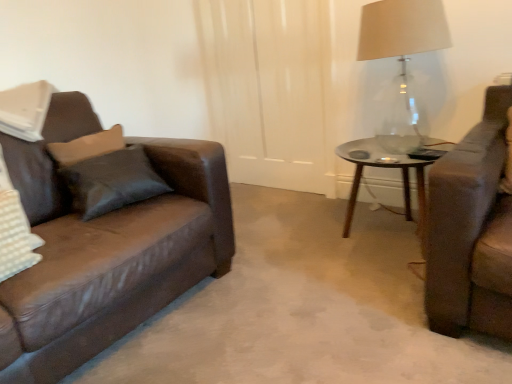
The width and height of the screenshot is (512, 384). What do you see at coordinates (383, 167) in the screenshot?
I see `transparent glass table at center` at bounding box center [383, 167].

The height and width of the screenshot is (384, 512). Identify the location of transparent glass table at center. (383, 167).

This screenshot has width=512, height=384. Find the location of `clear glass table lamp at upper right`. clear glass table lamp at upper right is located at coordinates (402, 58).

What do you see at coordinates (402, 58) in the screenshot? The width and height of the screenshot is (512, 384). I see `clear glass table lamp at upper right` at bounding box center [402, 58].

Where is `transparent glass table at center`? This screenshot has width=512, height=384. transparent glass table at center is located at coordinates (383, 167).

Between transparent glass table at center and clear glass table lamp at upper right, which one appears on the left side from the viewer's perspective?

From the viewer's perspective, clear glass table lamp at upper right appears more on the left side.

Which object is closer to the camera, transparent glass table at center or clear glass table lamp at upper right?

clear glass table lamp at upper right is more forward.

Is point (348, 231) closer or farther from the camera than point (366, 51)?

Point (348, 231).

From the image's perspective, is transparent glass table at center above or below clear glass table lamp at upper right?

transparent glass table at center is situated lower than clear glass table lamp at upper right in the image.

From a real-world perspective, which is physically below, transparent glass table at center or clear glass table lamp at upper right?

transparent glass table at center, from a real-world perspective.

Considering the relative sizes of transparent glass table at center and clear glass table lamp at upper right in the image provided, is transparent glass table at center wider than clear glass table lamp at upper right?

Indeed, transparent glass table at center has a greater width compared to clear glass table lamp at upper right.

Which of these two, transparent glass table at center or clear glass table lamp at upper right, stands shorter?

transparent glass table at center.

Between transparent glass table at center and clear glass table lamp at upper right, which one has larger size?

With larger size is clear glass table lamp at upper right.

Would you say transparent glass table at center is inside or outside clear glass table lamp at upper right?

transparent glass table at center is spatially situated outside clear glass table lamp at upper right.

Is transparent glass table at center positioned far away from clear glass table lamp at upper right?

No, transparent glass table at center is in close proximity to clear glass table lamp at upper right.

Based on the photo, is transparent glass table at center turned away from clear glass table lamp at upper right?

No, transparent glass table at center's orientation is not away from clear glass table lamp at upper right.

Where is `table lamp located on the left of transparent glass table at center`? table lamp located on the left of transparent glass table at center is located at coordinates (402, 58).

Would you say clear glass table lamp at upper right is to the left or to the right of transparent glass table at center in the picture?

In the image, clear glass table lamp at upper right appears on the left side of transparent glass table at center.

Considering the relative positions of clear glass table lamp at upper right and transparent glass table at center in the image provided, is clear glass table lamp at upper right behind transparent glass table at center?

No, the depth of clear glass table lamp at upper right is less than that of transparent glass table at center.

Which point is more forward, [413,100] or [406,155]?

The point [406,155] is closer to the camera.

From the image's perspective, is clear glass table lamp at upper right over transparent glass table at center?

Yes.

From a real-world perspective, is clear glass table lamp at upper right physically below transparent glass table at center?

No, from a real-world perspective, clear glass table lamp at upper right is not beneath transparent glass table at center.

Does clear glass table lamp at upper right have a greater width compared to transparent glass table at center?

No.

Does clear glass table lamp at upper right have a greater height compared to transparent glass table at center?

Indeed, clear glass table lamp at upper right has a greater height compared to transparent glass table at center.

Considering the relative sizes of clear glass table lamp at upper right and transparent glass table at center in the image provided, is clear glass table lamp at upper right smaller than transparent glass table at center?

Actually, clear glass table lamp at upper right might be larger than transparent glass table at center.

Is clear glass table lamp at upper right completely or partially outside of transparent glass table at center?

clear glass table lamp at upper right lies outside transparent glass table at center's area.

Looking at this image, does clear glass table lamp at upper right touch transparent glass table at center?

They are not placed beside each other.

Is transparent glass table at center at the back of clear glass table lamp at upper right?

No, clear glass table lamp at upper right is not facing the opposite direction of transparent glass table at center.

How many degrees apart are the facing directions of clear glass table lamp at upper right and transparent glass table at center?

0.000597 degrees separate the facing orientations of clear glass table lamp at upper right and transparent glass table at center.

Locate an element on the screen. Image resolution: width=512 pixels, height=384 pixels. table lamp located on the left of transparent glass table at center is located at coordinates (402, 58).

Where is `table lamp located above the transparent glass table at center (from a real-world perspective)`? The height and width of the screenshot is (384, 512). table lamp located above the transparent glass table at center (from a real-world perspective) is located at coordinates (402, 58).

Where is `coffee table on the right of clear glass table lamp at upper right`? Image resolution: width=512 pixels, height=384 pixels. coffee table on the right of clear glass table lamp at upper right is located at coordinates (383, 167).